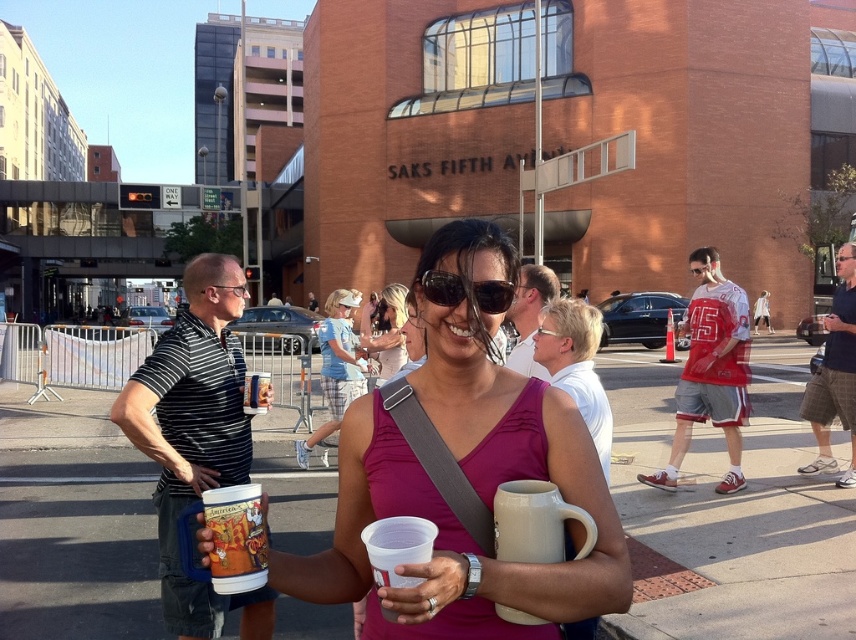
You are organizing a coffee stall and need to decide which of the two mugs, the white ceramic mug at center or the matte plastic mug at center, can hold more liquid. Based on their sizes, which one would you choose?

The white ceramic mug at center has a larger width than the matte plastic mug at center, so it can hold more liquid.

You are a delivery person who needs to place both the white ceramic mug at center and the matte plastic cup at center into a rectangular box. The box has a length of 24 inches. Can you fit both items side by side without overlapping?

The distance between the white ceramic mug at center and matte plastic cup at center is 23.35 inches, which is slightly less than the box length of 24 inches. Therefore, they can be placed side by side without overlapping.

You are a photographer trying to capture the woman holding both mugs clearly in your shot. Since you want to ensure the white ceramic mug at center is visible, where is it located relative to the matte plastic mug at center?

The white ceramic mug at center is positioned under the matte plastic mug at center, so it is partially hidden beneath it. To make it fully visible, you might need to adjust the angle or have the woman reposition her hands to lift the white ceramic mug at center higher.